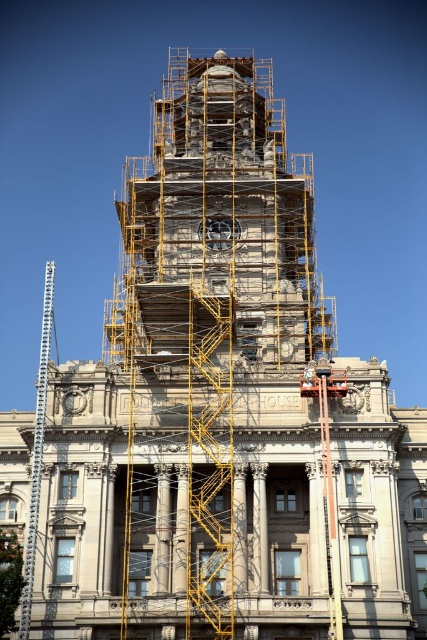
Question: Which of the following is the farthest from the observer?

Choices:
 (A) (310, 385)
 (B) (114, 340)

Answer: (B)

Question: Is stone scaffolding at center smaller than yellow metal scaffolding at center?

Choices:
 (A) no
 (B) yes

Answer: (A)

Question: Which point is farther from the camera taking this photo?

Choices:
 (A) (256, 252)
 (B) (224, 470)
 (C) (306, 380)

Answer: (A)

Question: Does stone scaffolding at center appear on the right side of yellow metal scaffolding at center?

Choices:
 (A) no
 (B) yes

Answer: (B)

Question: Which object appears closest to the camera in this image?

Choices:
 (A) yellow metal scaffolding at center
 (B) white hard hat at center
 (C) stone scaffolding at center

Answer: (A)

Question: Can you confirm if yellow metal scaffolding at center is thinner than white hard hat at center?

Choices:
 (A) no
 (B) yes

Answer: (A)